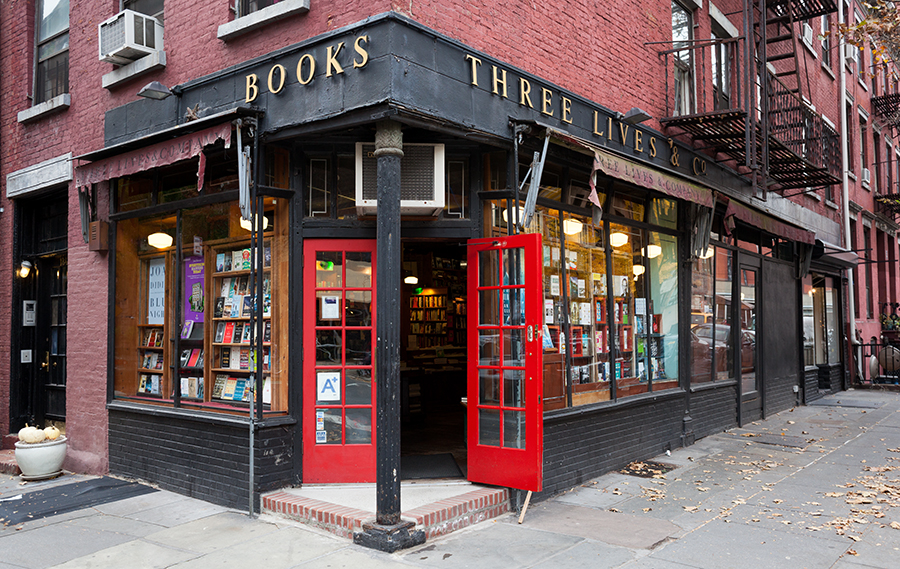
You are a GUI agent. You are given a task and a screenshot of the screen. Output one action in this format:
    pyautogui.click(x=<x>, y=<y>)
    Task: Click on the right brick wall
    The height and width of the screenshot is (569, 900).
    Given the screenshot: What is the action you would take?
    point(515,24)